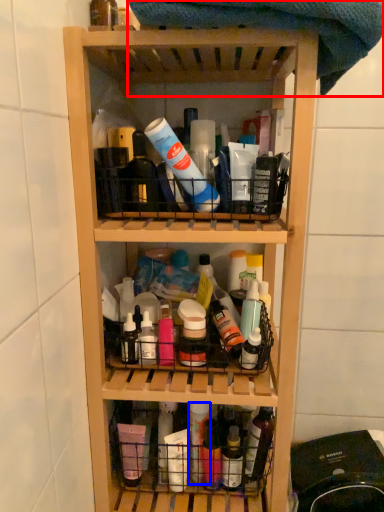
Question: Which object appears farthest to the camera in this image, beach towel (highlighted by a red box) or bottle (highlighted by a blue box)?

Choices:
 (A) beach towel
 (B) bottle

Answer: (B)